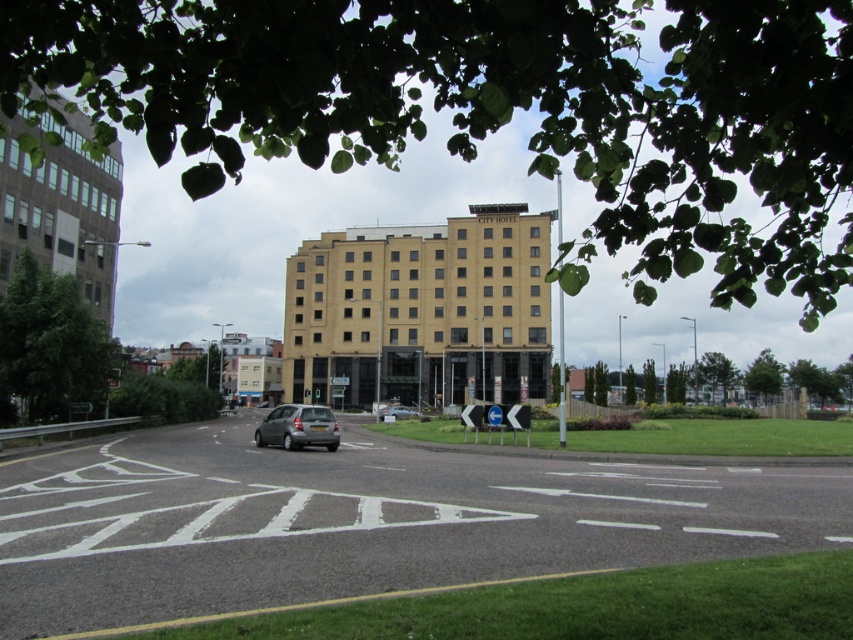
Question: In this image, where is silver metallic hatchback at center located relative to silver metallic car at center?

Choices:
 (A) right
 (B) left

Answer: (B)

Question: Is yellow brick building at center above silver metallic car at center?

Choices:
 (A) no
 (B) yes

Answer: (B)

Question: Does glassy reflective building at left have a larger size compared to silver metallic car at center?

Choices:
 (A) yes
 (B) no

Answer: (A)

Question: Among these objects, which one is nearest to the camera?

Choices:
 (A) silver metallic hatchback at center
 (B) yellow brick building at center
 (C) glassy reflective building at left

Answer: (C)

Question: Which point is closer to the camera?

Choices:
 (A) (285, 432)
 (B) (408, 321)
 (C) (93, 284)
 (D) (393, 410)

Answer: (A)

Question: Which point is closer to the camera?

Choices:
 (A) yellow brick building at center
 (B) glassy reflective building at left
 (C) silver metallic car at center

Answer: (B)